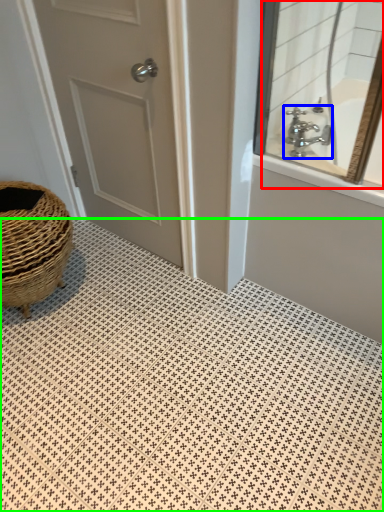
Question: Based on their relative distances, which object is nearer to mirror (highlighted by a red box)? Choose from tap (highlighted by a blue box) and pattern (highlighted by a green box).

Choices:
 (A) tap
 (B) pattern

Answer: (A)